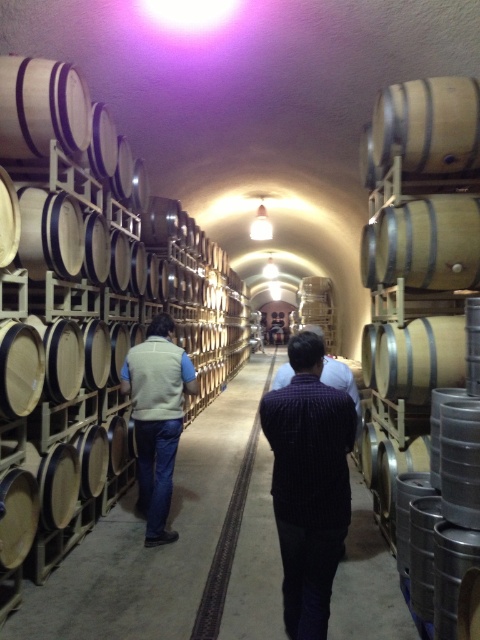
Question: Does natural wood barrel at center have a lesser width compared to wooden barrel at center?

Choices:
 (A) no
 (B) yes

Answer: (A)

Question: Does natural wood barrel at right have a larger size compared to light beige vest at center?

Choices:
 (A) yes
 (B) no

Answer: (A)

Question: Among these objects, which one is farthest from the camera?

Choices:
 (A) natural wood barrel at right
 (B) light beige vest at center
 (C) wooden barrel at center
 (D) dark striped shirt at center

Answer: (B)

Question: Which point is farther to the camera?

Choices:
 (A) natural wood barrel at center
 (B) dark striped shirt at center
 (C) light beige vest at center
 (D) natural wood barrel at right

Answer: (C)

Question: Which object is positioned closest to the natural wood barrel at right?

Choices:
 (A) wooden barrel at center
 (B) light beige vest at center
 (C) natural wood barrel at center

Answer: (A)

Question: Can you confirm if natural wood barrel at center is positioned to the right of light beige vest at center?

Choices:
 (A) no
 (B) yes

Answer: (A)